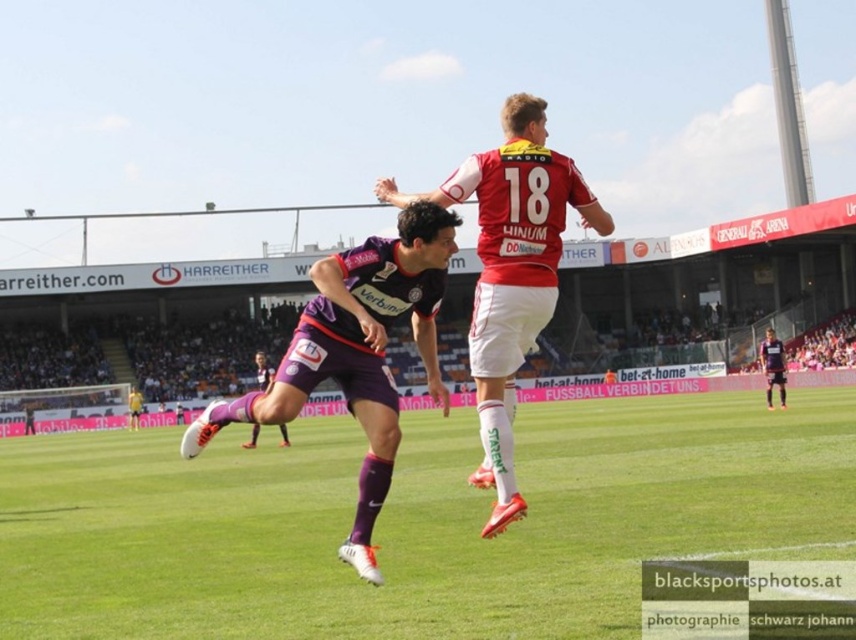
You are a photographer standing at the camera position. You want to capture a closeup shot of the purple matte jersey at center. The camera has a maximum zoom range of 20 feet. Can you get a clear closeup without moving the camera?

The purple matte jersey at center and camera are 32.20 feet apart. Since the maximum zoom is 20 feet, you cannot get a clear closeup without moving closer.

You are a referee watching the soccer match. You notice two players wearing the red jersey at center and the dark purple jersey at center. Which player is positioned higher in the air during the game moment captured?

The red jersey at center is above the dark purple jersey at center, so the player in the red jersey at center is positioned higher in the air.